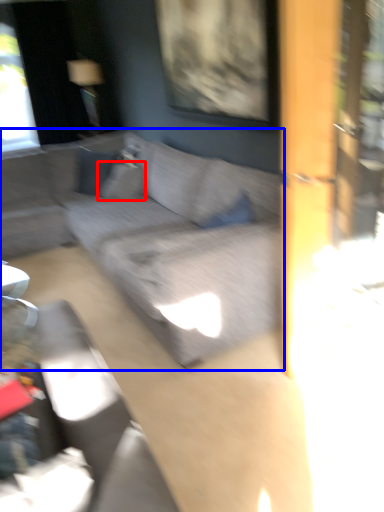
Question: Which object appears closest to the camera in this image, pillow (highlighted by a red box) or studio couch (highlighted by a blue box)?

Choices:
 (A) pillow
 (B) studio couch

Answer: (B)